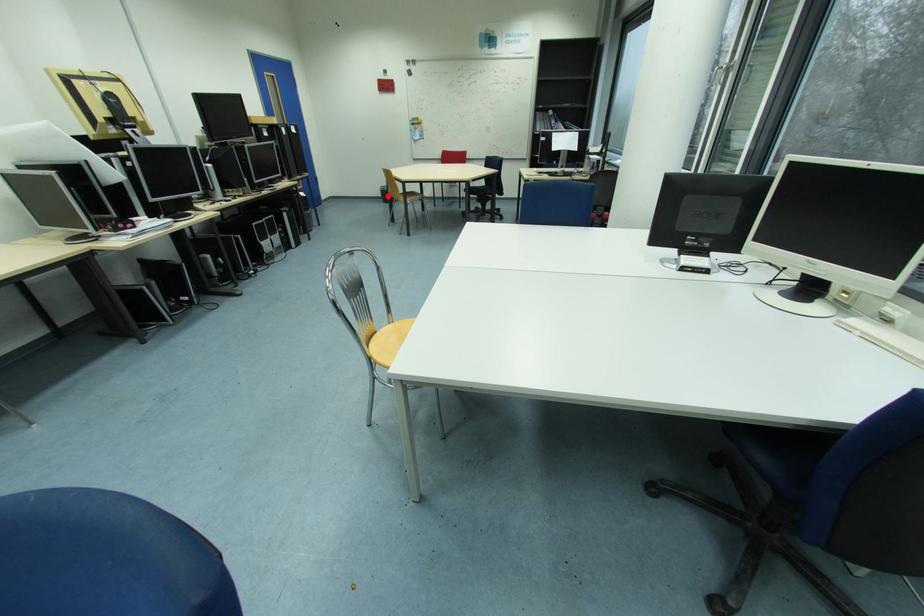
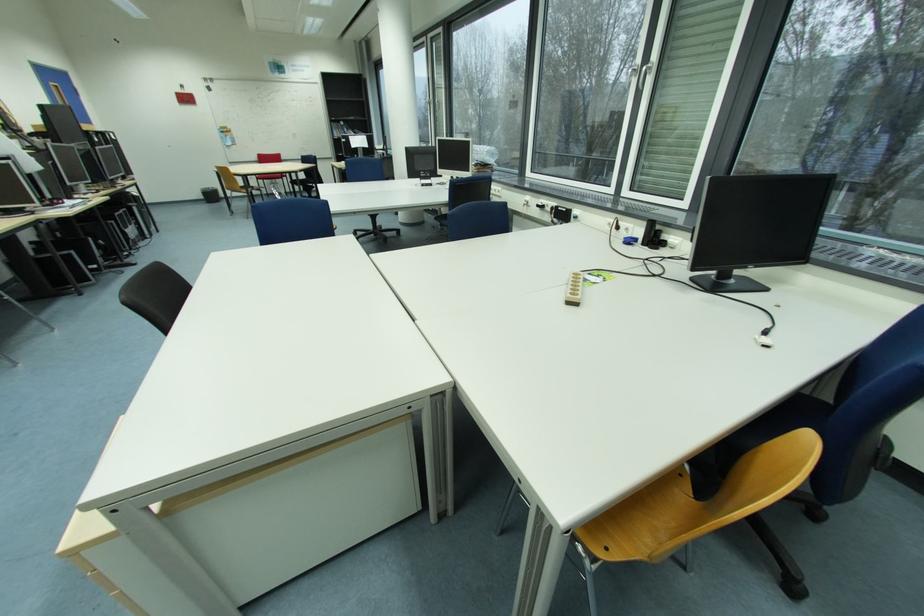
Find the pixel in the second image that matches the highlighted location in the first image.

(209, 198)